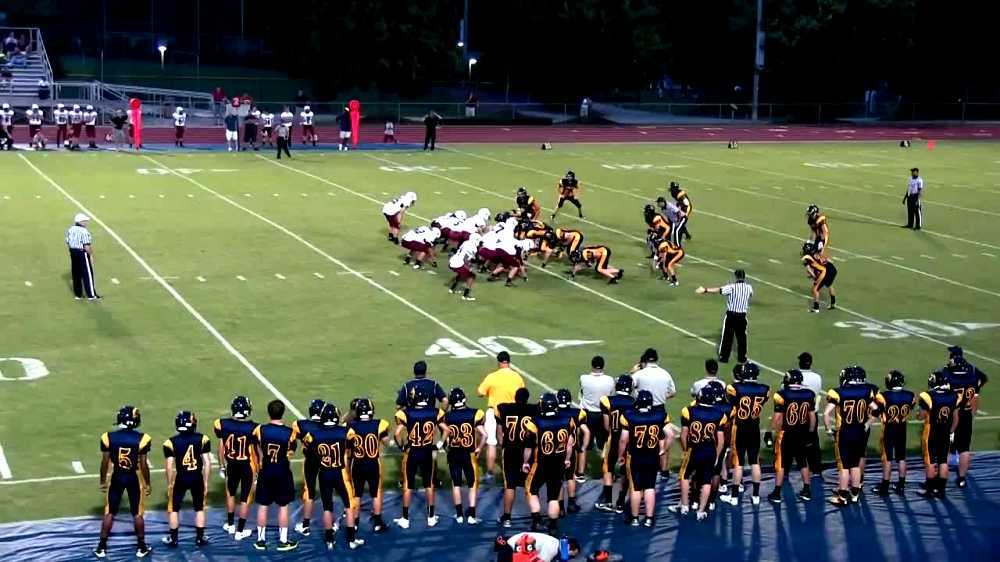
Identify the location of water bottles. 493,543, 505,554, 564,552, 605,554.